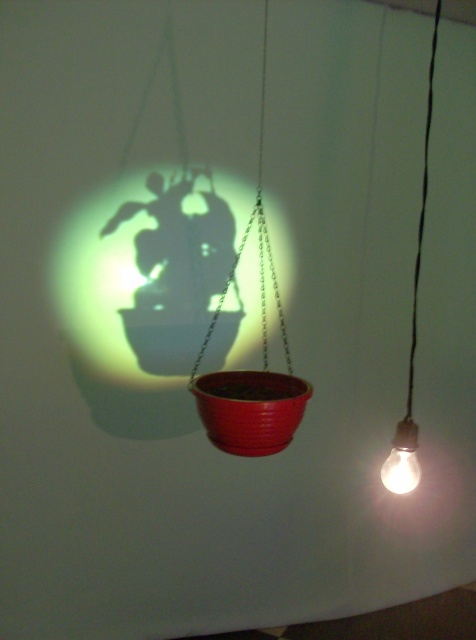
Is matte white bulb at right above matte white bulb at lower right?

Correct, matte white bulb at right is located above matte white bulb at lower right.

What are the coordinates of `matte white bulb at right` in the screenshot? It's located at (412, 337).

Does point (412, 470) come closer to viewer compared to point (407, 452)?

That is False.

Where is `matte white bulb at right`? Image resolution: width=476 pixels, height=640 pixels. matte white bulb at right is located at coordinates (412, 337).

Is matte plastic plant at center below matte white bulb at right?

Yes.

Does matte plastic plant at center have a smaller size compared to matte white bulb at right?

Correct, matte plastic plant at center occupies less space than matte white bulb at right.

Find the location of a particular element. The width and height of the screenshot is (476, 640). matte plastic plant at center is located at coordinates (179, 244).

Identify the location of matte plastic plant at center. (179, 244).

Measure the distance between matte plastic plant at center and camera.

matte plastic plant at center is 2.31 meters from camera.

The width and height of the screenshot is (476, 640). What do you see at coordinates (179, 244) in the screenshot?
I see `matte plastic plant at center` at bounding box center [179, 244].

Find the location of `matte plastic plant at center`. matte plastic plant at center is located at coordinates (179, 244).